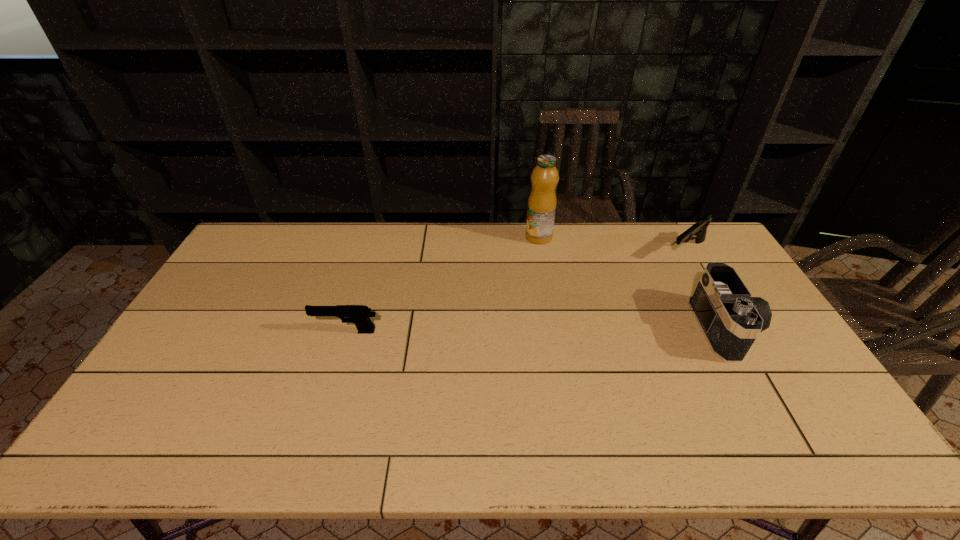
Find the location of a particular element. The image size is (960, 540). free space on the desktop that is between the pistol and the camera and is positioned at the aiming end of the gun is located at coordinates (588, 329).

This screenshot has height=540, width=960. I want to click on free space on the desktop that is between the leftmost object and the second tallest object and is positioned on the front label of the second object from left to right, so click(x=523, y=330).